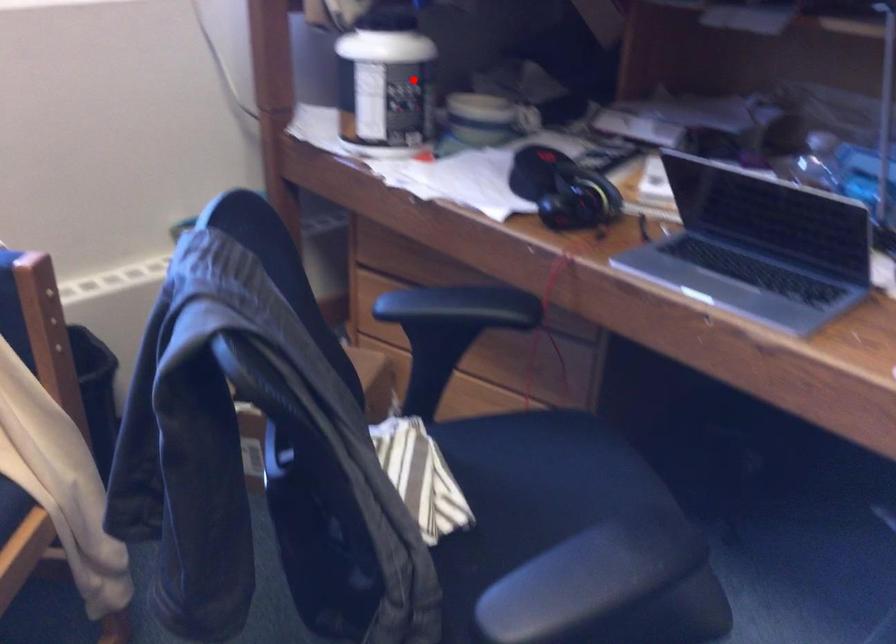
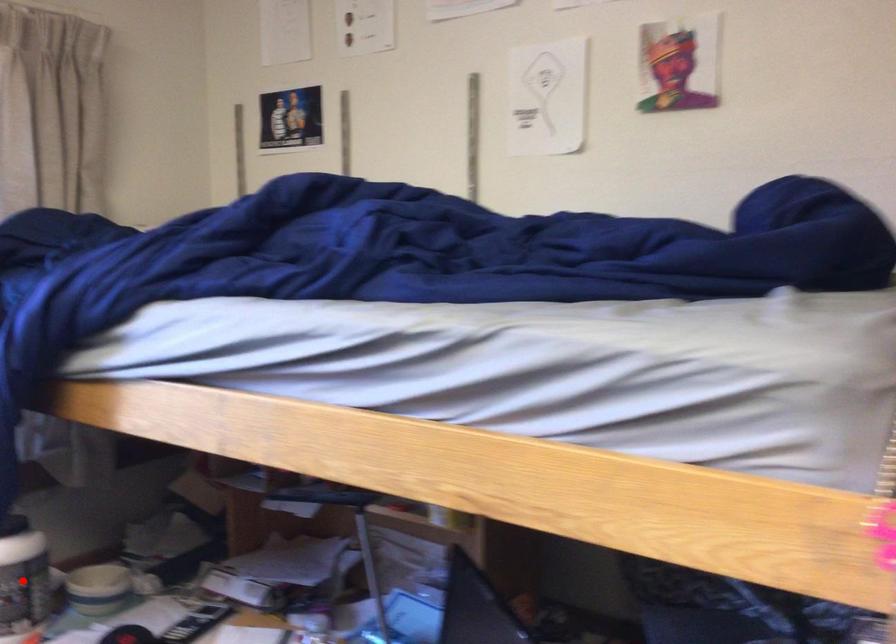
I am providing you with two images of the same scene from different viewpoints. A red point is marked on the first image and another point is marked on the second image. Is the red point in image1 aligned with the point shown in image2?

Yes